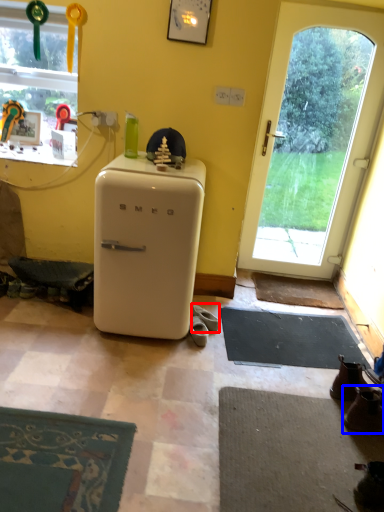
Question: Among these objects, which one is nearest to the camera, footwear (highlighted by a red box) or footwear (highlighted by a blue box)?

Choices:
 (A) footwear
 (B) footwear

Answer: (B)